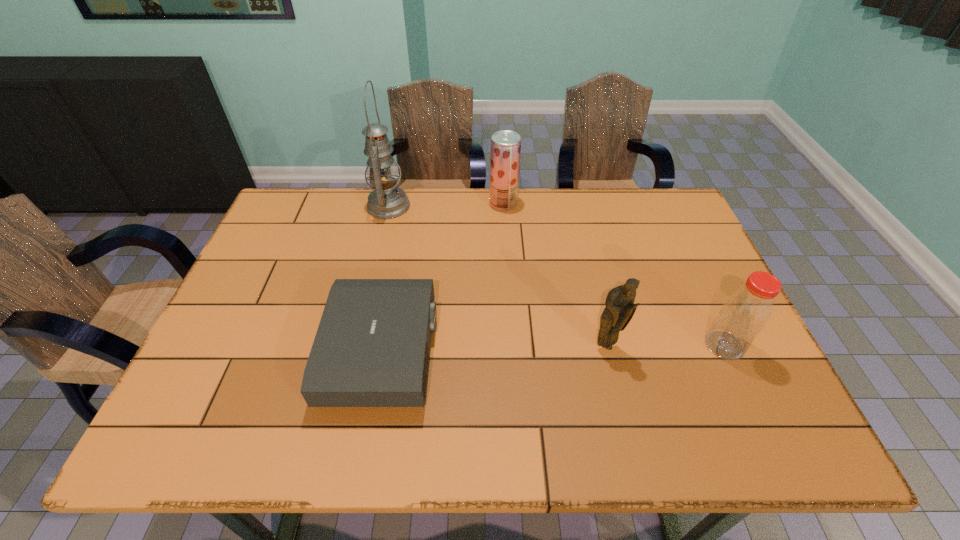
You are a GUI agent. You are given a task and a screenshot of the screen. Output one action in this format:
    pyautogui.click(x=<x>, y=<y>)
    Task: Click on the oil lamp
    This screenshot has width=960, height=540.
    Given the screenshot: What is the action you would take?
    pyautogui.click(x=387, y=201)

Where is `fruit juice`? fruit juice is located at coordinates (505, 150).

This screenshot has width=960, height=540. Find the location of `the second object from right to left`. the second object from right to left is located at coordinates (620, 308).

Image resolution: width=960 pixels, height=540 pixels. I want to click on the rightmost object, so click(x=745, y=313).

This screenshot has height=540, width=960. I want to click on projector, so click(372, 346).

What are the coordinates of `vacant space situated on the front of the tallest object` in the screenshot? It's located at (361, 323).

The width and height of the screenshot is (960, 540). In order to click on vacant space located on the right of the third object from left to right in this screenshot , I will do `click(539, 204)`.

Image resolution: width=960 pixels, height=540 pixels. I want to click on vacant area situated on the front-facing side of the fourth object from left to right, so click(x=613, y=377).

You are a GUI agent. You are given a task and a screenshot of the screen. Output one action in this format:
    pyautogui.click(x=<x>, y=<y>)
    Task: Click on the free location located on the left of the bottle
    Image resolution: width=960 pixels, height=540 pixels.
    Given the screenshot: What is the action you would take?
    pyautogui.click(x=552, y=345)

Find the location of a particular element. The image size is (960, 540). vacant region located on the front-facing side of the shortest object is located at coordinates (501, 352).